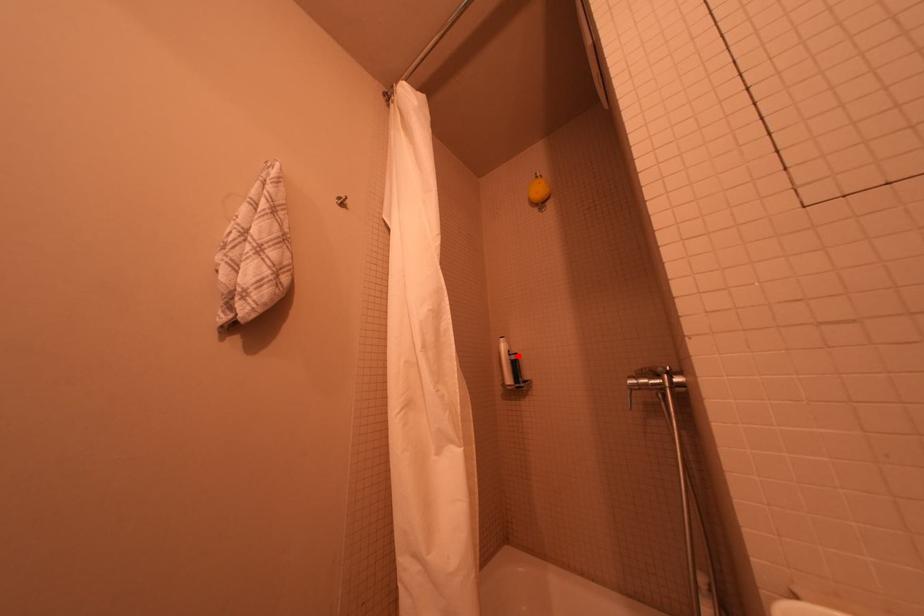
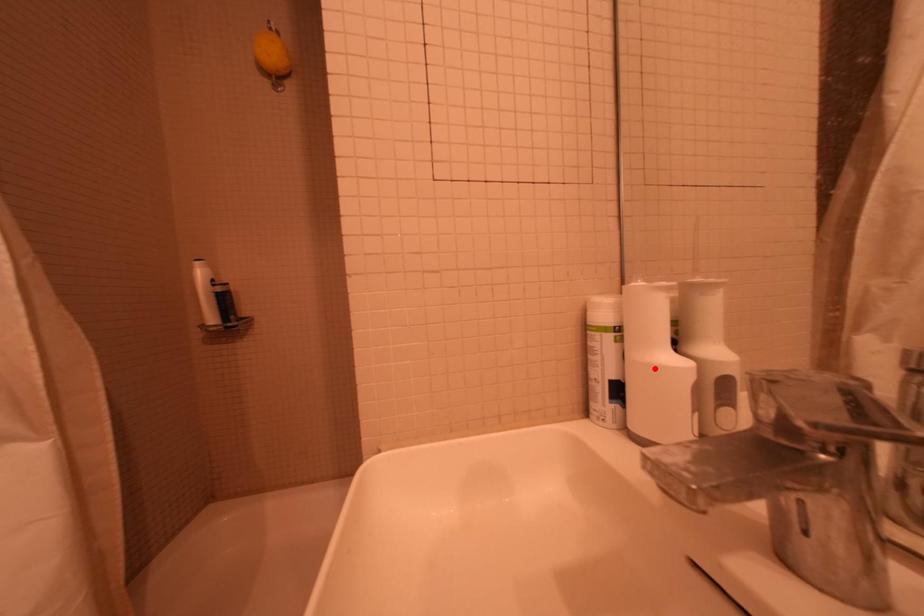
I am providing you with two images of the same scene from different viewpoints. A red point is marked on the first image and another point is marked on the second image. Are the points marked in image1 and image2 representing the same 3D position?

No